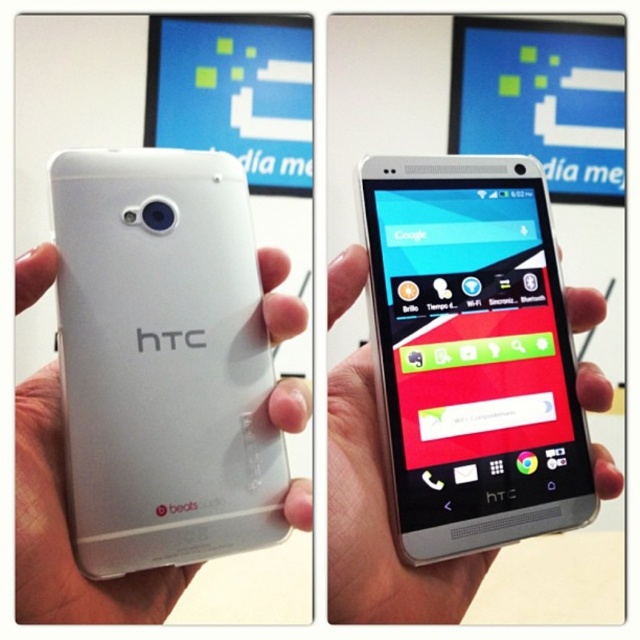
In the scene shown: Does white matte phone at center appear on the right side of white matte htc phone at center?

Correct, you'll find white matte phone at center to the right of white matte htc phone at center.

Can you confirm if white matte phone at center is wider than white matte htc phone at center?

Correct, the width of white matte phone at center exceeds that of white matte htc phone at center.

Measure the distance between point (380, 605) and camera.

20.14 inches

The height and width of the screenshot is (640, 640). I want to click on white matte phone at center, so click(x=378, y=522).